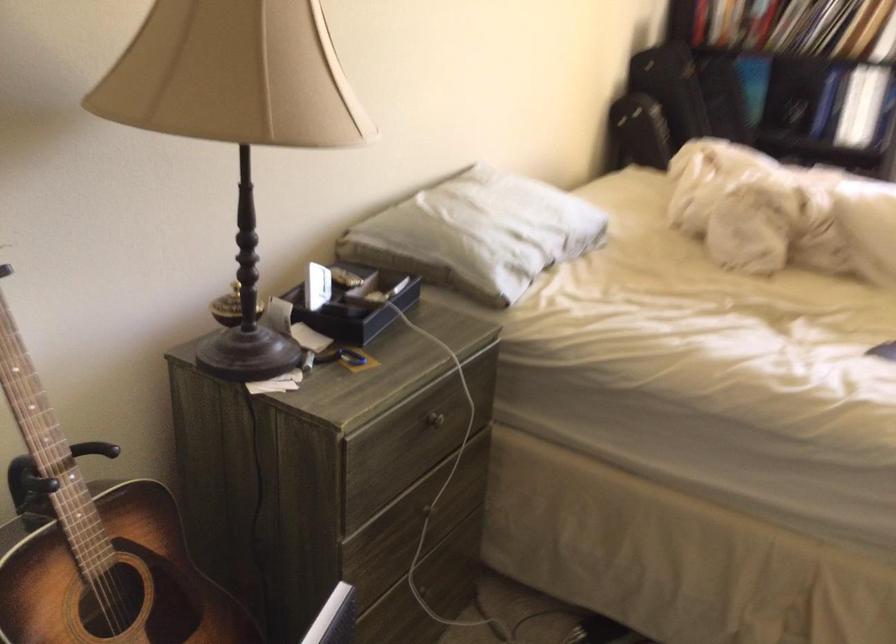
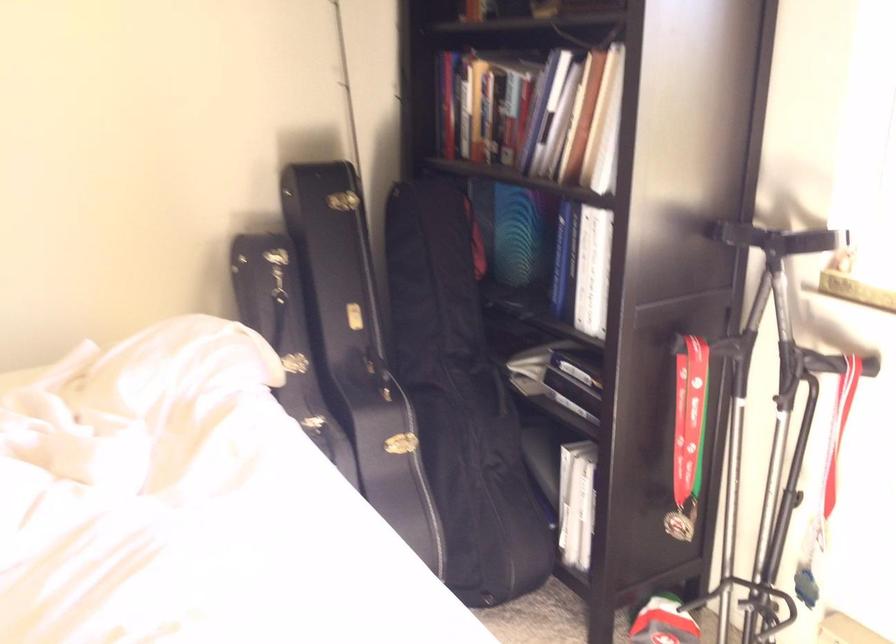
Find the pixel in the second image that matches pixel 736 73 in the first image.

(519, 236)